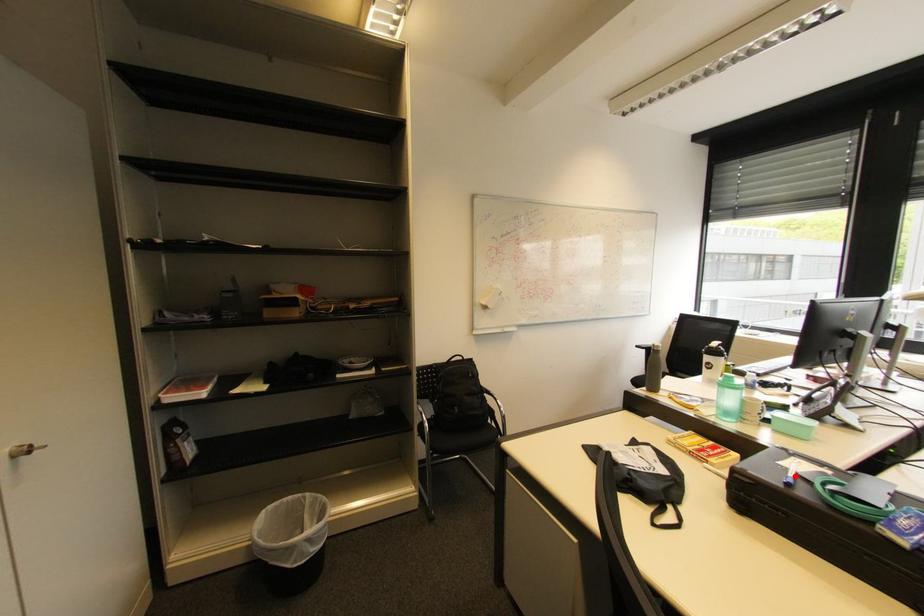
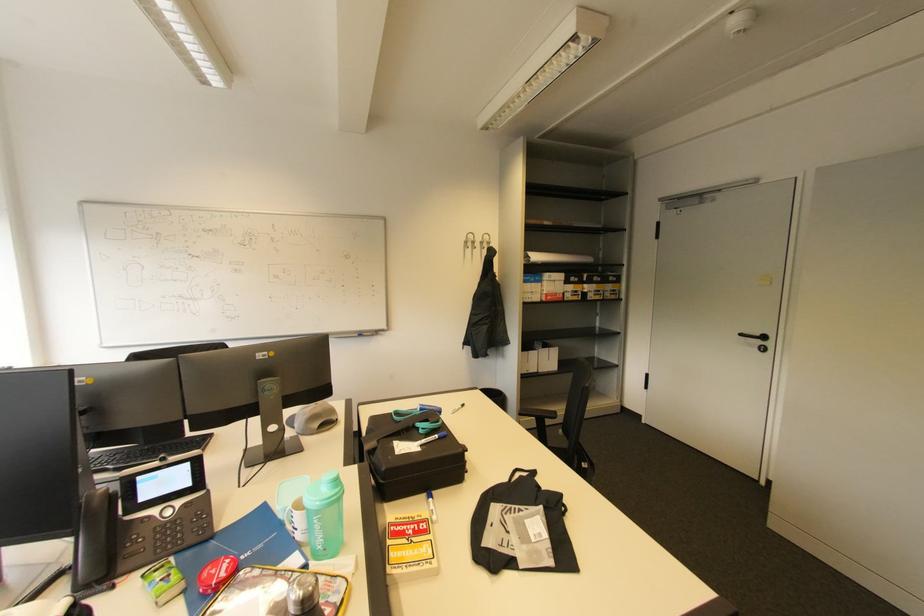
In the second image, find the point that corresponds to the highlighted location in the first image.

(441, 437)